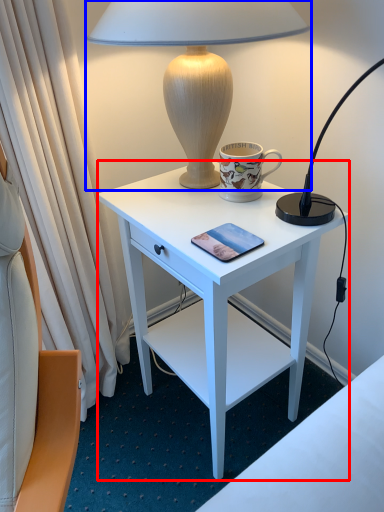
Question: Among these objects, which one is farthest to the camera, desk (highlighted by a red box) or lamp (highlighted by a blue box)?

Choices:
 (A) desk
 (B) lamp

Answer: (A)